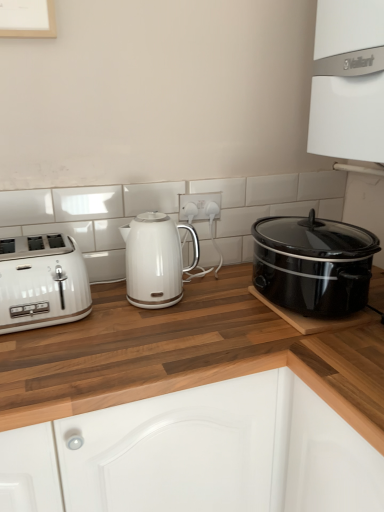
The height and width of the screenshot is (512, 384). What are the coordinates of `free space between white glossy toaster at left and white glossy kettle at center` in the screenshot? It's located at (106, 304).